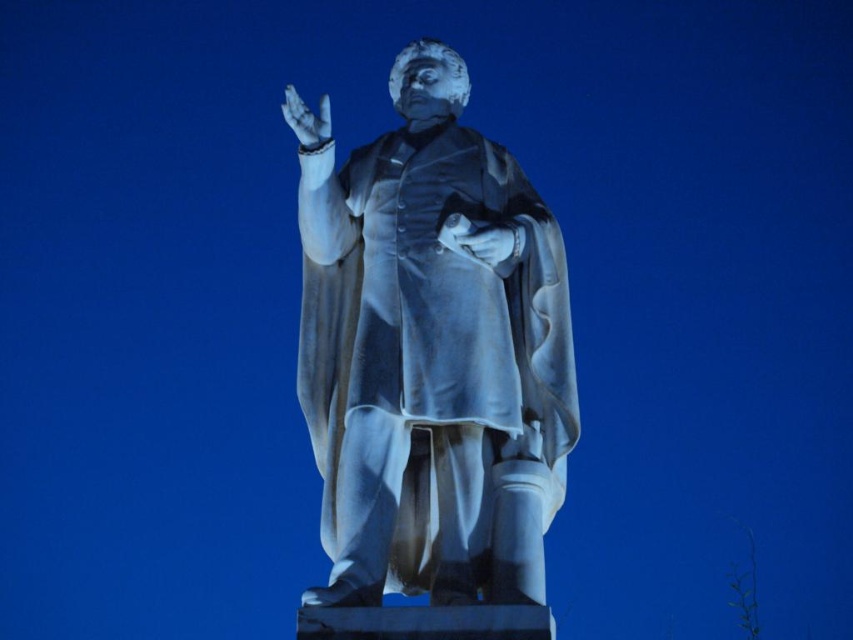
Is white marble glove at center shorter than white marble hand at upper center?

Indeed, white marble glove at center has a lesser height compared to white marble hand at upper center.

This screenshot has height=640, width=853. In order to click on white marble glove at center in this screenshot , I will do `click(480, 241)`.

Is white marble statue at center smaller than white marble glove at center?

No, white marble statue at center is not smaller than white marble glove at center.

Between point (448, 189) and point (448, 232), which one is positioned behind?

Point (448, 189)

The height and width of the screenshot is (640, 853). Describe the element at coordinates (430, 355) in the screenshot. I see `white marble statue at center` at that location.

This screenshot has width=853, height=640. Identify the location of white marble statue at center. point(430,355).

Can you confirm if white marble statue at center is thinner than white marble hand at upper center?

In fact, white marble statue at center might be wider than white marble hand at upper center.

Between point (480, 573) and point (309, 113), which one is positioned behind?

Positioned behind is point (309, 113).

Locate an element on the screen. The width and height of the screenshot is (853, 640). white marble statue at center is located at coordinates (430, 355).